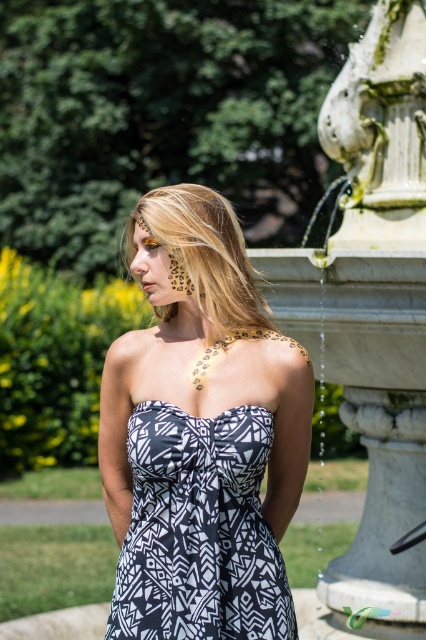
You are a photographer planning to take a portrait of the woman in the scene. You want to ensure the white marble fountain at right is visible in the background. Based on its position, where should you place the camera relative to the woman to include the fountain?

Since the white marble fountain at right is positioned at point (371, 314), you should place the camera to the right side of the woman to capture the fountain in the background.

You are a photographer taking a picture of the white marble fountain at right and the leopard print skin at center. Which object is closer to the camera?

The white marble fountain at right is closer to the camera because the leopard print skin at center is behind it.

You are a photographer trying to capture a full body shot of the woman with the blonde hair at center. The white marble fountain at right is in the background. Considering the height of the fountain compared to the woman, will you need to adjust your camera angle to include both the woman and the fountain in the frame?

The white marble fountain at right is much taller than the blonde hair at center, so you will need to adjust your camera angle to include both the woman and the fountain in the frame. You might want to lower your angle to capture the entire fountain while still keeping the woman in focus.